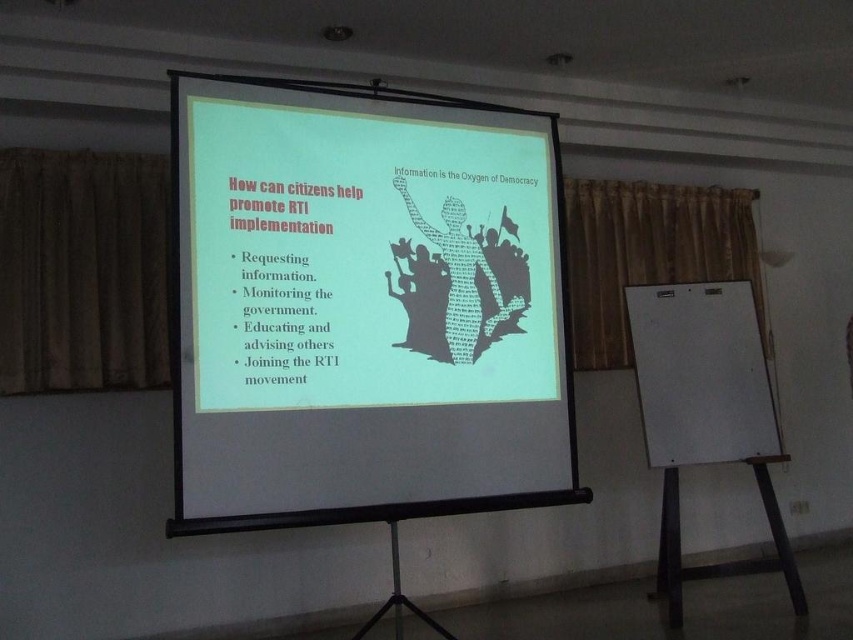
Question: Among these objects, which one is farthest from the camera?

Choices:
 (A) white matte projection screen at center
 (B) white matte easel at right

Answer: (B)

Question: Does white matte projection screen at center appear under white matte easel at right?

Choices:
 (A) yes
 (B) no

Answer: (B)

Question: Is white matte projection screen at center below white matte easel at right?

Choices:
 (A) yes
 (B) no

Answer: (B)

Question: In this image, where is white matte projection screen at center located relative to white matte easel at right?

Choices:
 (A) right
 (B) left

Answer: (B)

Question: Which object is closer to the camera taking this photo?

Choices:
 (A) white matte projection screen at center
 (B) white matte easel at right

Answer: (A)

Question: Which point appears farthest from the camera in this image?

Choices:
 (A) (676, 492)
 (B) (537, 493)

Answer: (A)